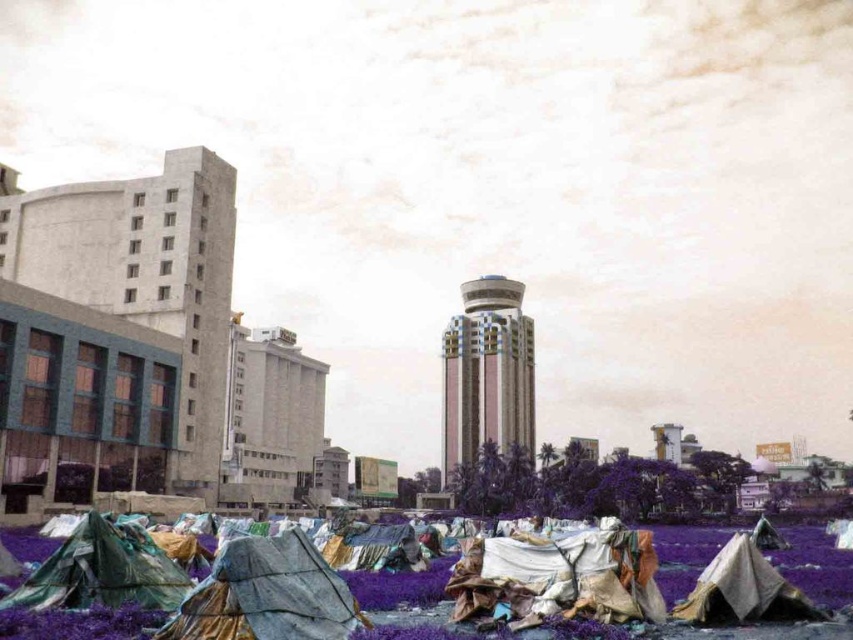
You are a city planner reviewing this urban scene. You need to determine the spatial relationship between the textured gray tarp at lower left and the pink glossy tower at center. Which object is positioned higher in the scene?

The textured gray tarp at lower left is located above the pink glossy tower at center, so it is positioned higher in the scene.

Based on the photo, you are standing at the center of the image. Which direction should you move to reach the textured gray tarp at lower left?

You should move to the left and downward from your current position at the center of the image to reach the textured gray tarp at lower left, as it is located at point (267,595).

In the scene shown: You are standing in the urban landscape and want to take a photo of the pink glossy tower at center without the textured gray tarp at lower left blocking the view. Where should you move to achieve this?

Move further away from the textured gray tarp at lower left so that it is no longer in front of the pink glossy tower at center, as the tarp is closer to you than the tower.